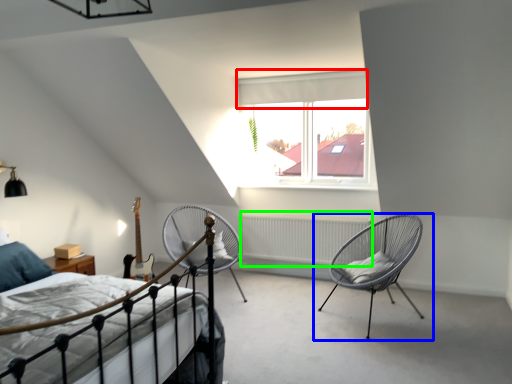
Question: Estimate the real-world distances between objects in this image. Which object is closer to curtain (highlighted by a red box), chair (highlighted by a blue box) or radiator (highlighted by a green box)?

Choices:
 (A) chair
 (B) radiator

Answer: (B)